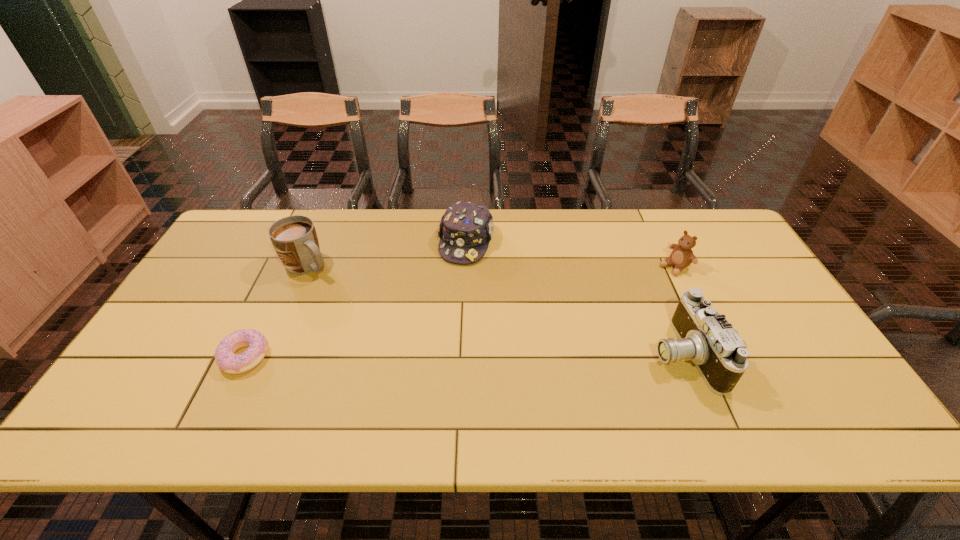
The image size is (960, 540). Identify the location of doughnut at the near edge. (257, 344).

Identify the location of camera present at the near edge. The width and height of the screenshot is (960, 540). 705,337.

The width and height of the screenshot is (960, 540). I want to click on free spot at the far edge of the desktop, so click(341, 246).

Identify the location of free space at the near edge of the desktop. This screenshot has height=540, width=960. (668, 385).

Where is `free location at the left edge of the desktop`? The height and width of the screenshot is (540, 960). free location at the left edge of the desktop is located at coordinates (211, 300).

Identify the location of vacant point at the right edge. coord(749,327).

Image resolution: width=960 pixels, height=540 pixels. In the image, there is a desktop. What are the coordinates of `vacant space at the far left corner` in the screenshot? It's located at (240, 231).

In the image, there is a desktop. What are the coordinates of `vacant space at the far right corner` in the screenshot? It's located at (732, 243).

The width and height of the screenshot is (960, 540). What are the coordinates of `free spot between the camera and the mug` in the screenshot? It's located at (495, 310).

Image resolution: width=960 pixels, height=540 pixels. I want to click on empty location between the mug and the headwear, so click(387, 254).